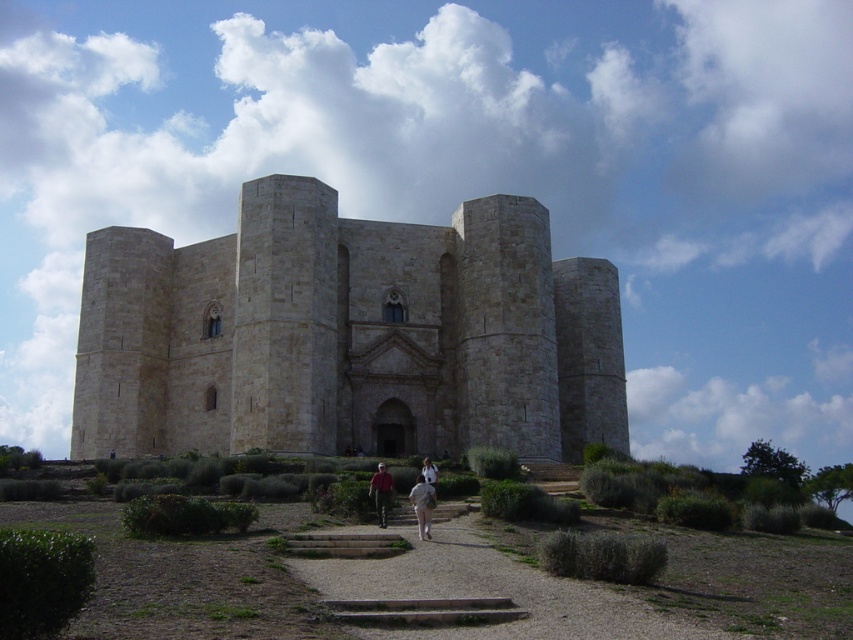
Does beige stone castle at center appear on the right side of red shirt at center?

Incorrect, beige stone castle at center is not on the right side of red shirt at center.

Find the location of a particular element. The image size is (853, 640). beige stone castle at center is located at coordinates (347, 333).

This screenshot has height=640, width=853. I want to click on beige stone castle at center, so click(347, 333).

Which of these two, light beige fabric pants at center or red shirt at center, stands shorter?

light beige fabric pants at center is shorter.

Is light beige fabric pants at center wider than red shirt at center?

Indeed, light beige fabric pants at center has a greater width compared to red shirt at center.

Is point (430, 502) closer to camera compared to point (386, 513)?

That is True.

The image size is (853, 640). In order to click on light beige fabric pants at center in this screenshot , I will do `click(422, 506)`.

Is beige stone castle at center positioned behind light beige fabric pants at center?

Yes, beige stone castle at center is further from the viewer.

Is point (177, 364) positioned behind point (434, 493)?

Yes, it is behind point (434, 493).

Identify the location of beige stone castle at center. The image size is (853, 640). (347, 333).

This screenshot has width=853, height=640. I want to click on beige stone castle at center, so click(x=347, y=333).